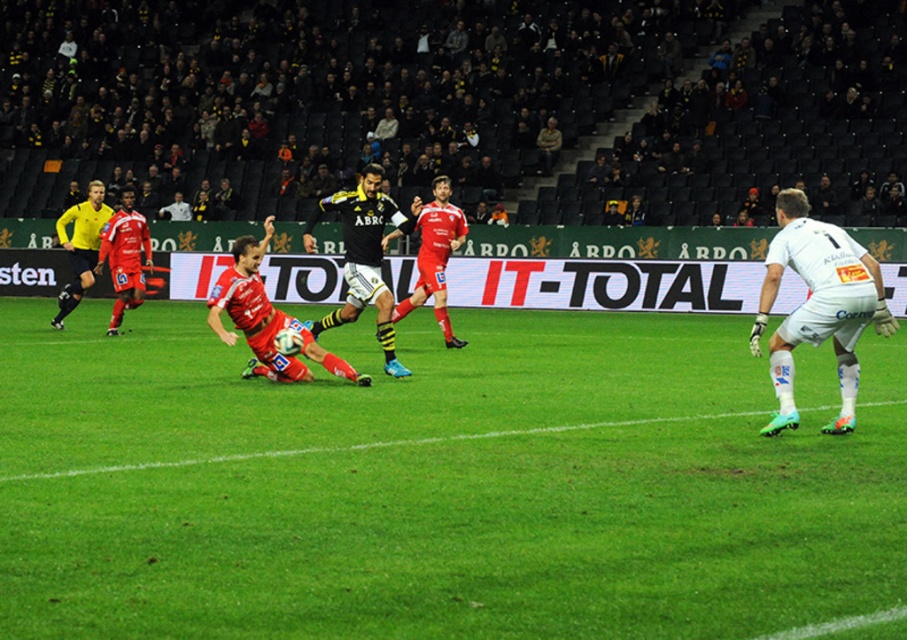
Question: Which object appears farthest from the camera in this image?

Choices:
 (A) green grass football field at center
 (B) red matte soccer player at center

Answer: (B)

Question: Which object is positioned closest to the black jersey at center?

Choices:
 (A) yellow matte referee at left
 (B) red matte soccer player at center
 (C) white matte jersey at right

Answer: (B)

Question: Considering the relative positions of white matte jersey at right and yellow matte referee at left in the image provided, where is white matte jersey at right located with respect to yellow matte referee at left?

Choices:
 (A) below
 (B) above

Answer: (A)

Question: Is the position of red matte soccer player at center less distant than that of yellow matte referee at left?

Choices:
 (A) no
 (B) yes

Answer: (B)

Question: Which of the following is the closest to the observer?

Choices:
 (A) (787, 384)
 (B) (435, 198)
 (C) (393, 374)
 (D) (371, 241)

Answer: (A)

Question: Is green grass football field at center closer to camera compared to red matte soccer player at center?

Choices:
 (A) no
 (B) yes

Answer: (B)